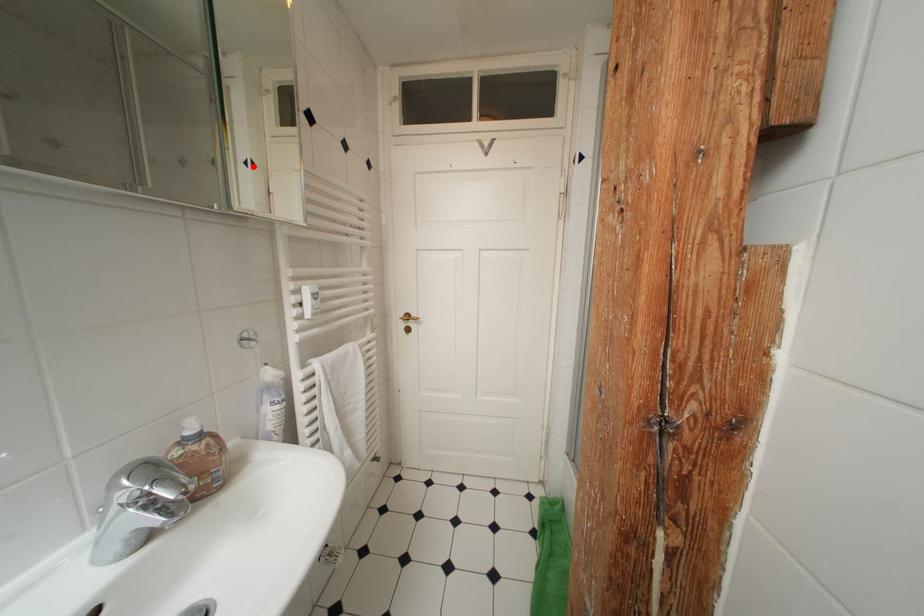
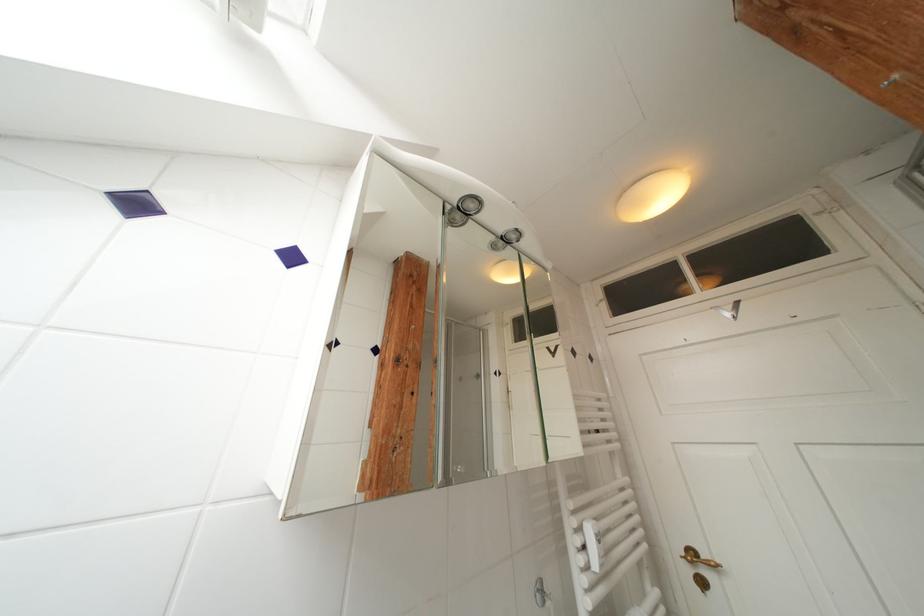
Locate, in the second image, the point that corresponds to the highlighted location in the first image.

(502, 377)